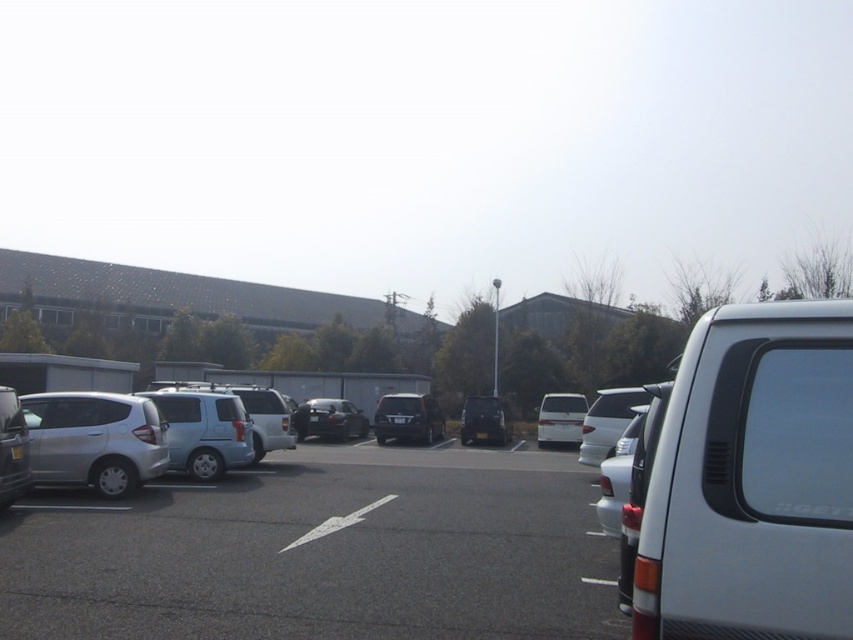
You are standing at the center of the parking lot and want to locate the satin black van at center. According to the coordinates given, where would you find it?

The satin black van at center is located at coordinates point (x=407, y=419).

You are a delivery driver who needs to park your truck in the parking lot. You see the satin silver car at left and the silver metallic sedan at left. Which vehicle is blocking the parking space directly below the other?

The satin silver car at left is positioned under the silver metallic sedan at left, meaning the satin silver car is blocking the parking space directly below the silver metallic sedan.